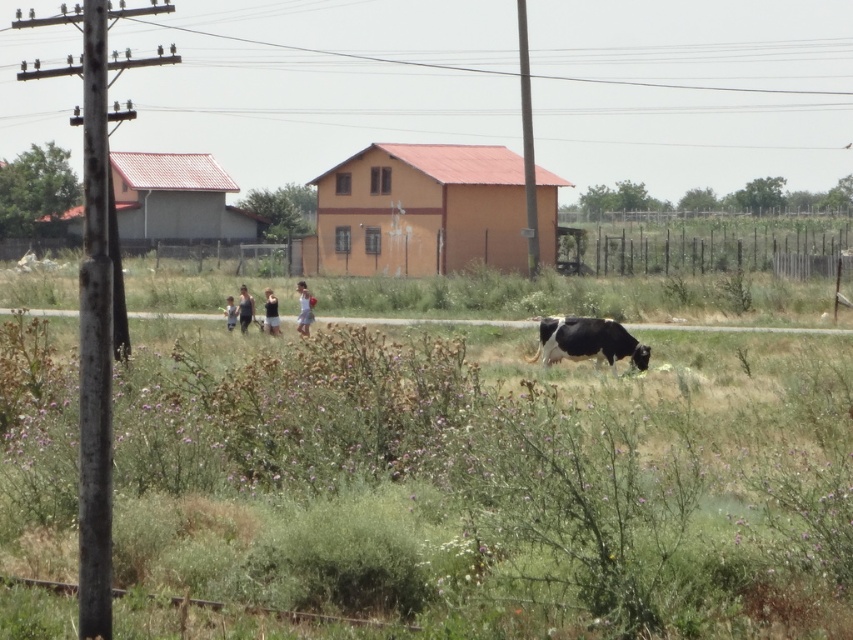
You are a photographer trying to capture a candid shot of the two people wearing the dark gray fabric shirt at center and the dark blue tank top at center. Since you want to focus on their clothing, which one should you zoom in on to ensure the clothing detail is clear?

You should zoom in on the dark blue tank top at center because it occupies more space than the dark gray fabric shirt at center, making it easier to capture clear details of the clothing.

You are a photographer standing at the edge of the field. You want to take a photo that includes both the black and white spotted bull at center and the dark gray fabric shirt at center. What is the minimum distance you need to move backward to ensure both subjects are in frame?

The minimum distance you need to move backward is 9.73 meters to ensure both the black and white spotted bull at center and the dark gray fabric shirt at center are in frame.

You are a photographer trying to capture a group photo of the people walking on the path. You notice the black and white spotted bull at center and the dark gray fabric shirt at center are in the frame. Which object should you adjust your camera angle to avoid since it is wider?

The black and white spotted bull at center is wider than the dark gray fabric shirt at center, so you should adjust your camera angle to avoid the black and white spotted bull at center.